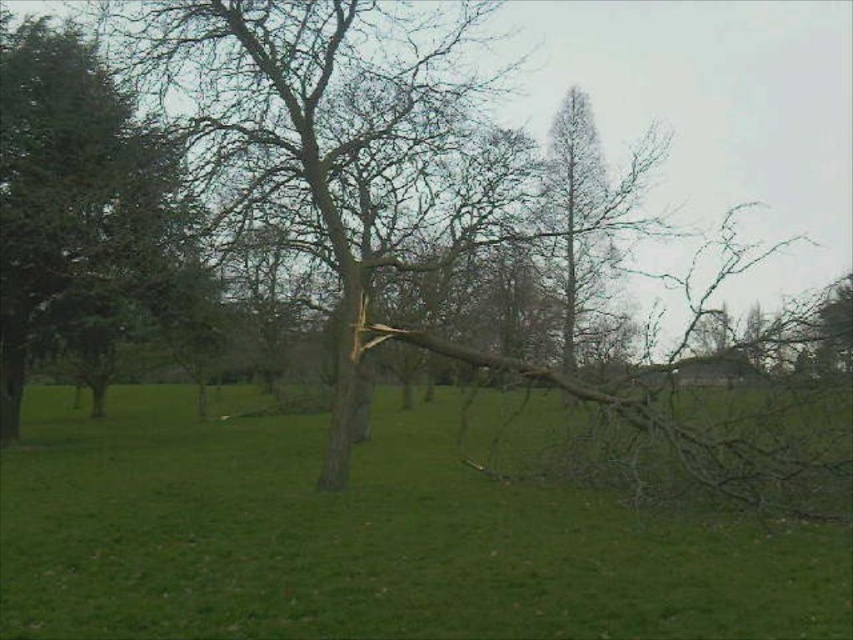
Question: Can you confirm if brown wood log at center is positioned to the right of green leafy tree at left?

Choices:
 (A) no
 (B) yes

Answer: (B)

Question: Among these points, which one is farthest from the camera?

Choices:
 (A) (138, 228)
 (B) (440, 486)

Answer: (A)

Question: Does brown wood log at center appear on the right side of green leafy tree at left?

Choices:
 (A) no
 (B) yes

Answer: (B)

Question: Is brown wood log at center above green leafy tree at left?

Choices:
 (A) yes
 (B) no

Answer: (B)

Question: Which of the following is the farthest from the observer?

Choices:
 (A) (227, 525)
 (B) (55, 99)

Answer: (B)